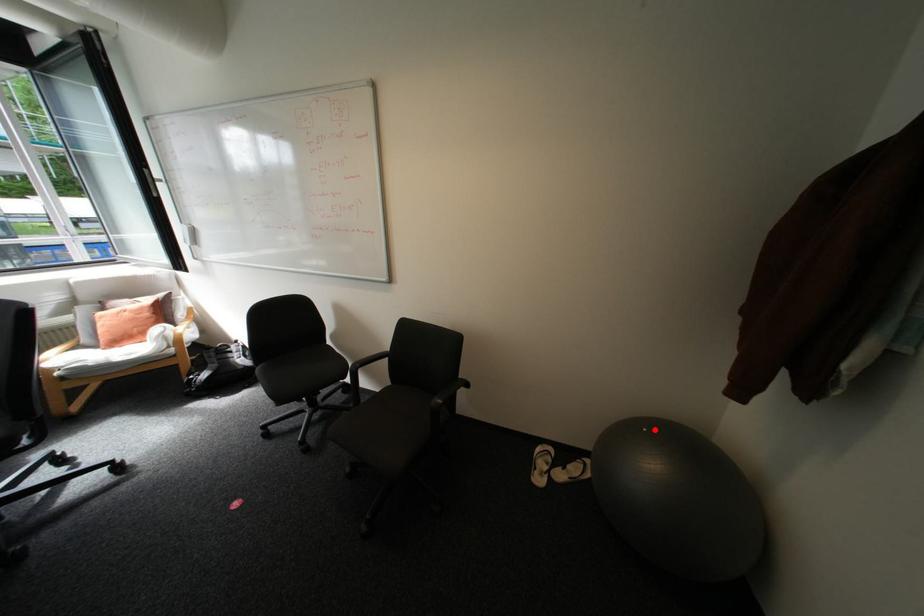
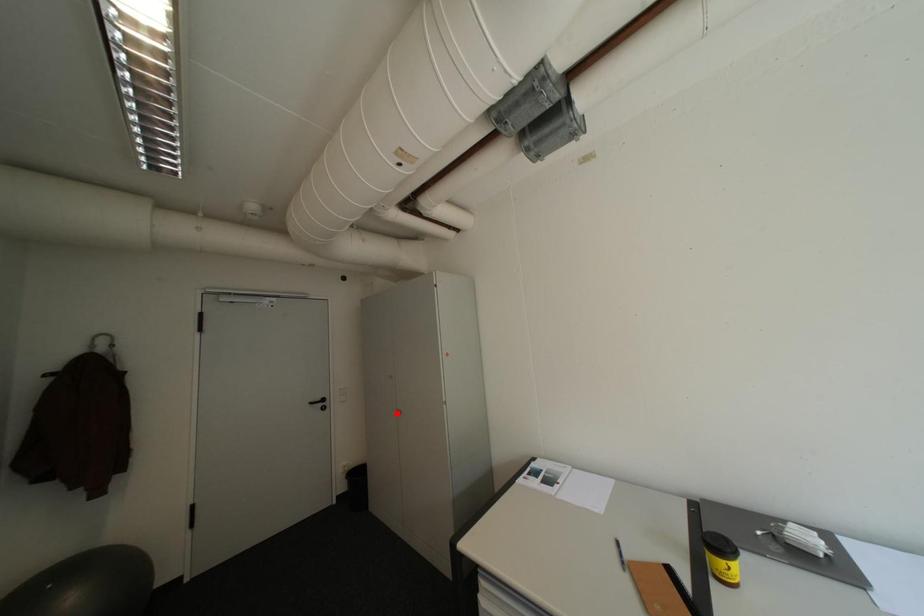
I am providing you with two images of the same scene from different viewpoints. A red point is marked on the first image and another point is marked on the second image. Is the red point in image1 aligned with the point shown in image2?

No